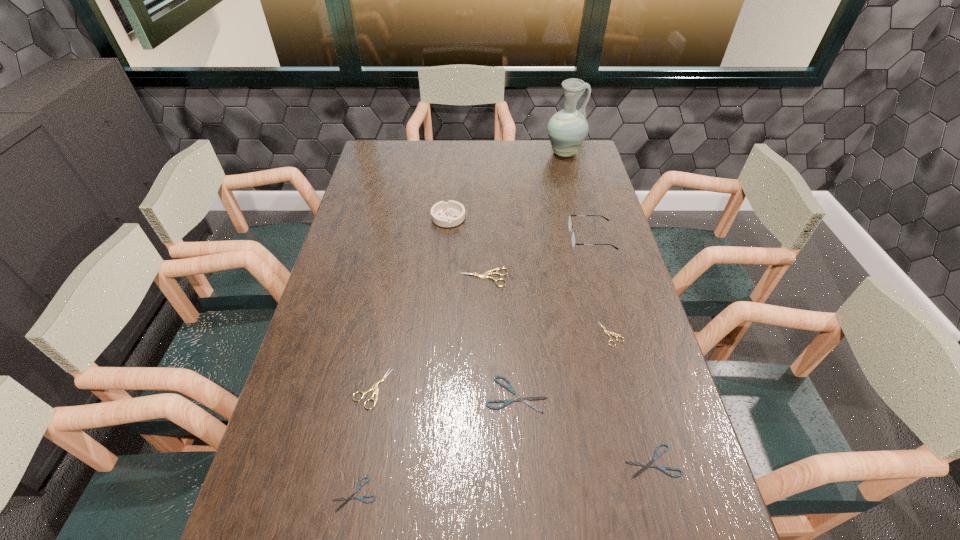
Image resolution: width=960 pixels, height=540 pixels. In the image, there is a desktop. Identify the location of vacant space at the left edge. (375, 191).

Where is `blank space at the right edge of the desktop`? This screenshot has height=540, width=960. blank space at the right edge of the desktop is located at coordinates (635, 453).

This screenshot has height=540, width=960. Identify the location of unoccupied position between the second black shears from right to left and the fourth farthest object. pyautogui.click(x=500, y=336).

Locate an element on the screen. vacant area between the tallest shears and the tallest object is located at coordinates (524, 215).

In order to click on vacant area that lies between the shortest shears and the farthest object in this screenshot , I will do `click(460, 323)`.

You are a GUI agent. You are given a task and a screenshot of the screen. Output one action in this format:
    pyautogui.click(x=<x>, y=<y>)
    Task: Click on the vacant region between the second farthest shears and the second black shears from right to left
    This screenshot has width=960, height=540.
    Given the screenshot: What is the action you would take?
    pyautogui.click(x=564, y=364)

Where is `free space between the leftmost beige shears and the tallest shears`? This screenshot has height=540, width=960. free space between the leftmost beige shears and the tallest shears is located at coordinates (428, 333).

Find the location of `vacant area between the ashtray and the second smallest black shears`. vacant area between the ashtray and the second smallest black shears is located at coordinates (550, 339).

Image resolution: width=960 pixels, height=540 pixels. Find the location of `empty location between the second tallest shears and the tallest object`. empty location between the second tallest shears and the tallest object is located at coordinates (468, 271).

Locate an element on the screen. vacant area between the eighth shortest object and the seventh shortest object is located at coordinates (520, 228).